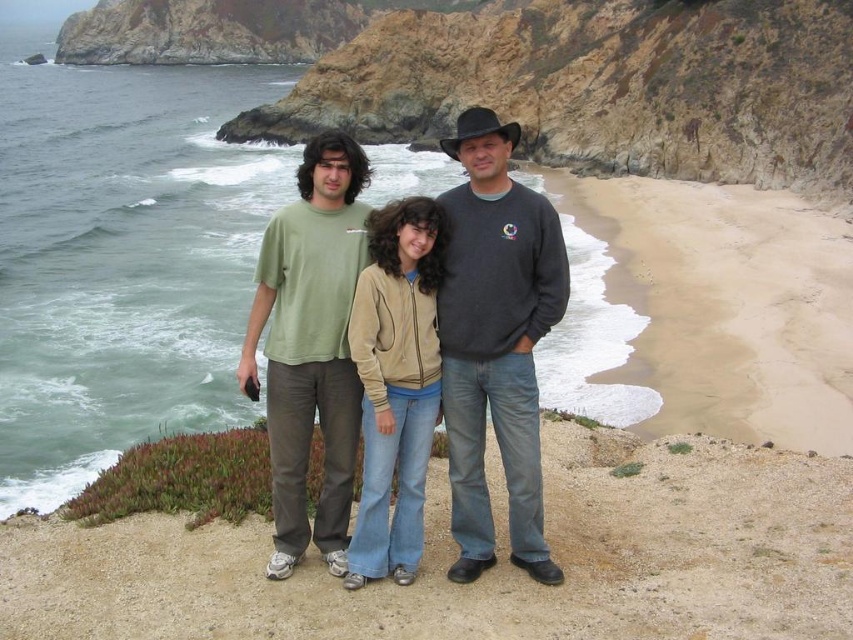
Based on the photo, is matte green t-shirt at center to the right of dark gray sweater at center from the viewer's perspective?

In fact, matte green t-shirt at center is to the left of dark gray sweater at center.

Does point (480, 236) come behind point (444, 385)?

No, (480, 236) is closer to viewer.

I want to click on matte green t-shirt at center, so click(x=495, y=340).

Is matte green t-shirt at center to the left of green cotton t-shirt at center from the viewer's perspective?

In fact, matte green t-shirt at center is to the right of green cotton t-shirt at center.

Between matte green t-shirt at center and green cotton t-shirt at center, which one appears on the right side from the viewer's perspective?

Positioned to the right is matte green t-shirt at center.

Measure the distance between point (537,380) and camera.

They are 16.87 meters apart.

At what (x,y) coordinates should I click in order to perform the action: click on matte green t-shirt at center. Please return your answer as a coordinate pair (x, y). The height and width of the screenshot is (640, 853). Looking at the image, I should click on (495, 340).

Does dark gray sweater at center have a greater height compared to tan suede jacket at center?

Correct, dark gray sweater at center is much taller as tan suede jacket at center.

This screenshot has width=853, height=640. What do you see at coordinates (495, 340) in the screenshot?
I see `dark gray sweater at center` at bounding box center [495, 340].

Where is `dark gray sweater at center`? The image size is (853, 640). dark gray sweater at center is located at coordinates (495, 340).